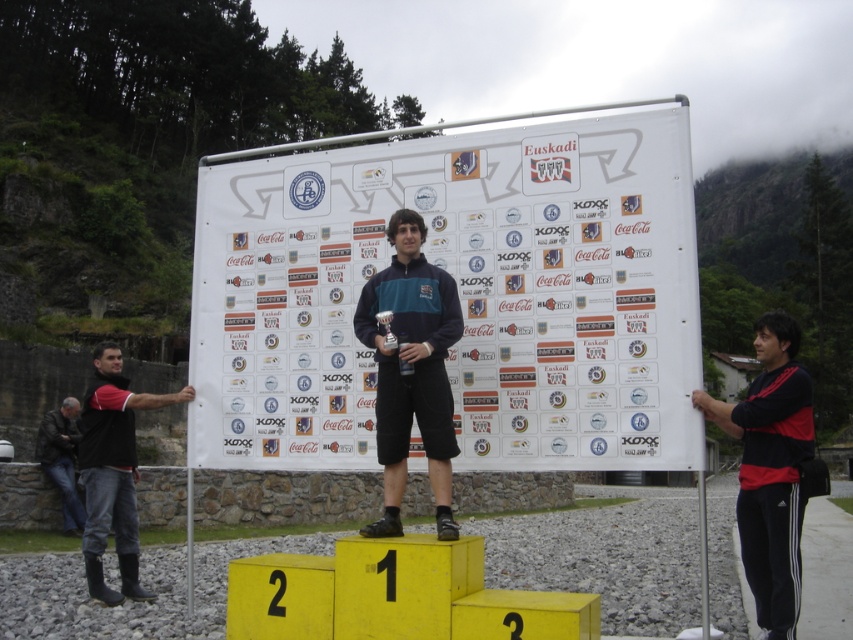
Consider the image. Between dark blue jersey at center and black/red adidas tracksuit at right, which one appears on the left side from the viewer's perspective?

Positioned to the left is dark blue jersey at center.

Is point (409, 429) closer to camera compared to point (775, 358)?

Yes, it is.

Describe the element at coordinates (410, 369) in the screenshot. The width and height of the screenshot is (853, 640). I see `dark blue jersey at center` at that location.

Where is `dark blue jersey at center`? This screenshot has height=640, width=853. dark blue jersey at center is located at coordinates (410, 369).

Between dark blue jersey at center and black rubber boots at left, which one has less height?

dark blue jersey at center is shorter.

Where is `dark blue jersey at center`? This screenshot has width=853, height=640. dark blue jersey at center is located at coordinates (410, 369).

Identify the location of dark blue jersey at center. The width and height of the screenshot is (853, 640). [x=410, y=369].

In the scene shown: Is the position of dark blue jersey at center less distant than that of leather jacket at left?

Yes, it is in front of leather jacket at left.

This screenshot has width=853, height=640. I want to click on dark blue jersey at center, so click(410, 369).

This screenshot has width=853, height=640. What are the coordinates of `dark blue jersey at center` in the screenshot? It's located at (410, 369).